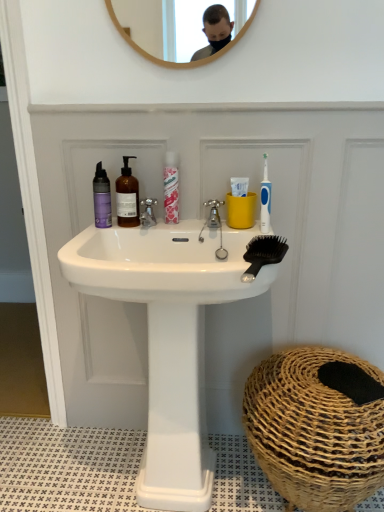
Question: Can you confirm if white glossy sink at center is wider than purple matte bottle at left, placed as the third mouthwash when sorted from right to left?

Choices:
 (A) yes
 (B) no

Answer: (A)

Question: Is white glossy sink at center aimed at purple matte bottle at left, which is the first mouthwash in left-to-right order?

Choices:
 (A) yes
 (B) no

Answer: (B)

Question: Is purple matte bottle at left, which is the first mouthwash in left-to-right order, a part of white glossy sink at center?

Choices:
 (A) yes
 (B) no

Answer: (B)

Question: Is white glossy sink at center to the left of purple matte bottle at left, placed as the third mouthwash when sorted from right to left, from the viewer's perspective?

Choices:
 (A) yes
 (B) no

Answer: (B)

Question: From the image's perspective, is white glossy sink at center under purple matte bottle at left, placed as the third mouthwash when sorted from right to left?

Choices:
 (A) no
 (B) yes

Answer: (B)

Question: Is the position of white glossy sink at center less distant than that of purple matte bottle at left, placed as the third mouthwash when sorted from right to left?

Choices:
 (A) yes
 (B) no

Answer: (A)

Question: Does silver metallic faucet at center, arranged as the first tap when viewed from the left, appear on the left side of translucent amber bottle at center, acting as the 2th mouthwash starting from the left?

Choices:
 (A) no
 (B) yes

Answer: (A)

Question: Can you confirm if silver metallic faucet at center, arranged as the first tap when viewed from the left, is shorter than translucent amber bottle at center, which is counted as the second mouthwash, starting from the right?

Choices:
 (A) yes
 (B) no

Answer: (A)

Question: From a real-world perspective, is silver metallic faucet at center, arranged as the first tap when viewed from the left, over translucent amber bottle at center, acting as the 2th mouthwash starting from the left?

Choices:
 (A) yes
 (B) no

Answer: (B)

Question: Could you tell me if silver metallic faucet at center, arranged as the first tap when viewed from the left, is facing translucent amber bottle at center, which is counted as the second mouthwash, starting from the right?

Choices:
 (A) no
 (B) yes

Answer: (A)

Question: From the image's perspective, would you say silver metallic faucet at center, which appears as the 2th tap when viewed from the right, is shown under translucent amber bottle at center, acting as the 2th mouthwash starting from the left?

Choices:
 (A) yes
 (B) no

Answer: (A)

Question: Does silver metallic faucet at center, arranged as the first tap when viewed from the left, come in front of translucent amber bottle at center, acting as the 2th mouthwash starting from the left?

Choices:
 (A) yes
 (B) no

Answer: (B)

Question: Is there a large distance between brown woven basket at lower right and white glossy sink at center?

Choices:
 (A) yes
 (B) no

Answer: (B)